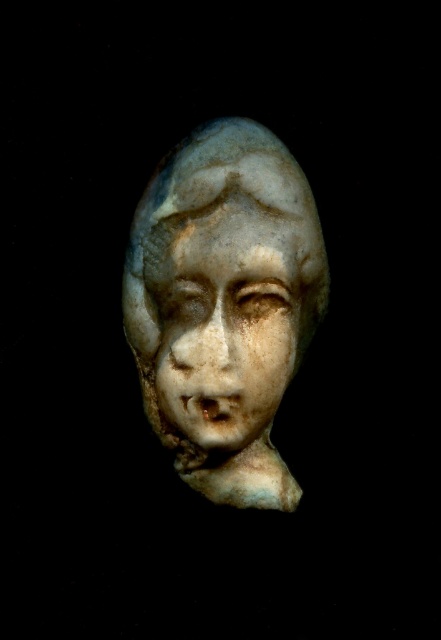
Question: Which point is closer to the camera taking this photo?

Choices:
 (A) (168, 234)
 (B) (255, 132)

Answer: (A)

Question: Does white marble bust at center come behind white marble face at center?

Choices:
 (A) no
 (B) yes

Answer: (A)

Question: Observing the image, what is the correct spatial positioning of white marble bust at center in reference to white marble face at center?

Choices:
 (A) right
 (B) left

Answer: (A)

Question: From the image, what is the correct spatial relationship of white marble bust at center in relation to white marble face at center?

Choices:
 (A) right
 (B) left

Answer: (A)

Question: Among these points, which one is nearest to the camera?

Choices:
 (A) (246, 260)
 (B) (160, 273)

Answer: (A)